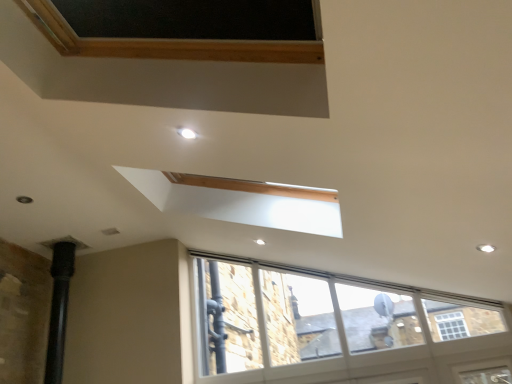
Describe the element at coordinates (337, 329) in the screenshot. I see `white matte window at center` at that location.

This screenshot has width=512, height=384. Identify the location of white matte window at center. (337, 329).

Find the location of a particular element. The height and width of the screenshot is (384, 512). white matte window at center is located at coordinates (337, 329).